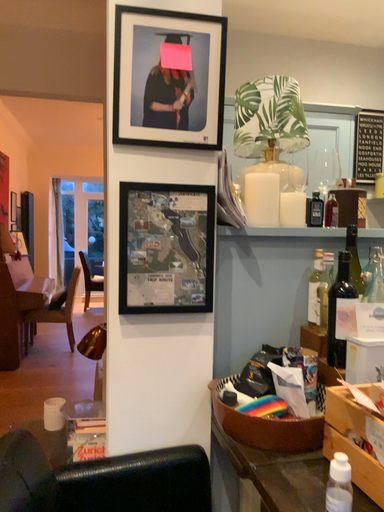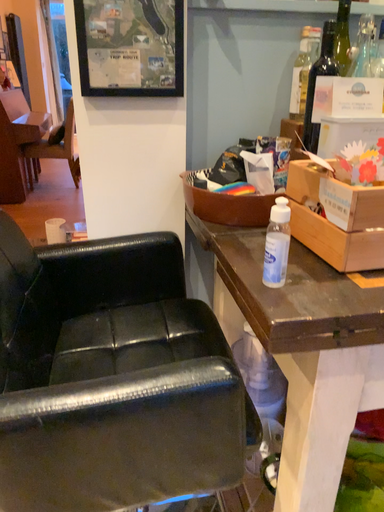
Question: Which way did the camera rotate in the video?

Choices:
 (A) rotated downward
 (B) rotated upward

Answer: (A)